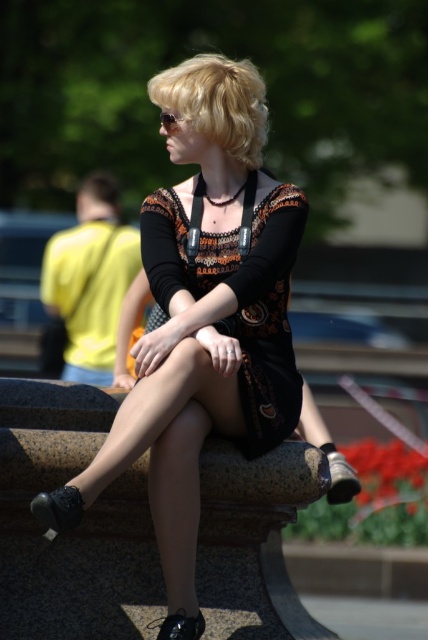
Does matte black dress at center appear on the left side of yellow fabric short at left?

No, matte black dress at center is not to the left of yellow fabric short at left.

This screenshot has width=428, height=640. Identify the location of matte black dress at center. (204, 317).

Is black lace dress at center positioned in front of yellow fabric short at left?

Yes, it is in front of yellow fabric short at left.

Does black lace dress at center appear under yellow fabric short at left?

Yes, black lace dress at center is below yellow fabric short at left.

Who is more forward, (x=276, y=413) or (x=112, y=248)?

Point (x=276, y=413)

Where is `black lace dress at center`? The height and width of the screenshot is (640, 428). black lace dress at center is located at coordinates (237, 292).

Who is taller, matte black dress at center or blonde hair at center?

With more height is blonde hair at center.

Can you confirm if matte black dress at center is thinner than blonde hair at center?

No.

Where is `matte black dress at center`? The image size is (428, 640). matte black dress at center is located at coordinates (204, 317).